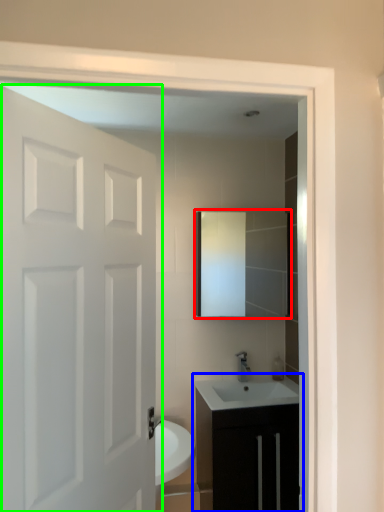
Question: Which object is positioned closest to mirror (highlighted by a red box)? Select from bathroom cabinet (highlighted by a blue box) and door (highlighted by a green box).

Choices:
 (A) bathroom cabinet
 (B) door

Answer: (A)